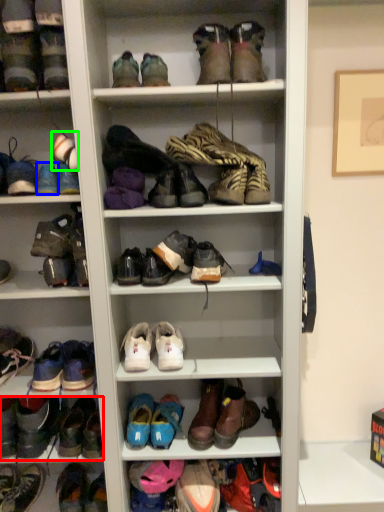
Question: Which object is the closest to the footwear (highlighted by a red box)? Choose among these: shoe (highlighted by a blue box) or shoe (highlighted by a green box).

Choices:
 (A) shoe
 (B) shoe

Answer: (A)